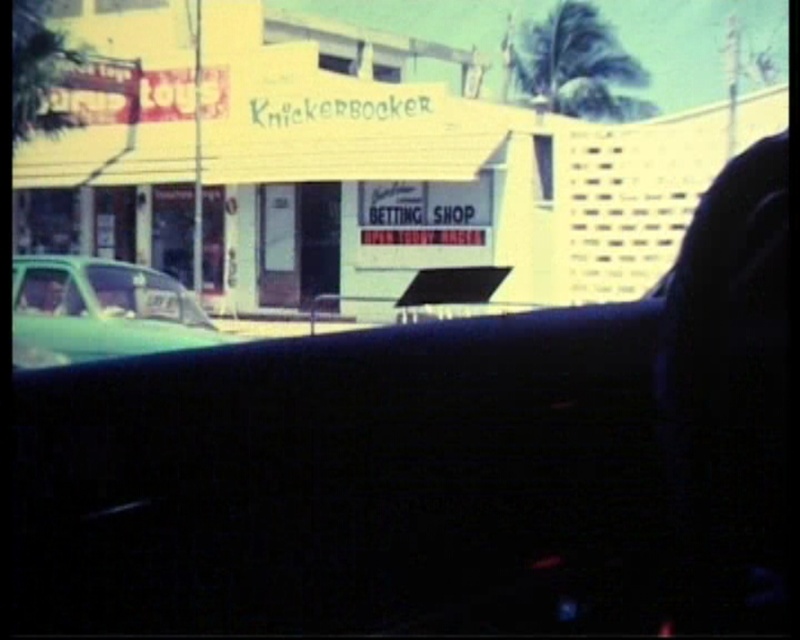
Who is lower down, green matte windshield at lower left or clear glass window at left?

Positioned lower is clear glass window at left.

Is point (170, 278) less distant than point (61, 310)?

That is False.

You are a GUI agent. You are given a task and a screenshot of the screen. Output one action in this format:
    pyautogui.click(x=<x>, y=<y>)
    Task: Click on the green matte windshield at lower left
    Image resolution: width=800 pixels, height=640 pixels.
    Given the screenshot: What is the action you would take?
    pyautogui.click(x=144, y=294)

Which is in front, point (154, 307) or point (180, 310)?

Point (154, 307) is in front.

Who is higher up, teal glossy car at left or green matte windshield at lower left?

green matte windshield at lower left

Does point (200, 308) come closer to viewer compared to point (146, 280)?

No, (200, 308) is further to viewer.

This screenshot has width=800, height=640. In order to click on teal glossy car at left in this screenshot , I will do `click(102, 310)`.

Between teal glossy car at left and clear glass window at left, which one has more height?

With more height is teal glossy car at left.

This screenshot has width=800, height=640. What are the coordinates of `teal glossy car at left` in the screenshot? It's located at (102, 310).

Find the location of a particular element. The image size is (800, 640). teal glossy car at left is located at coordinates (102, 310).